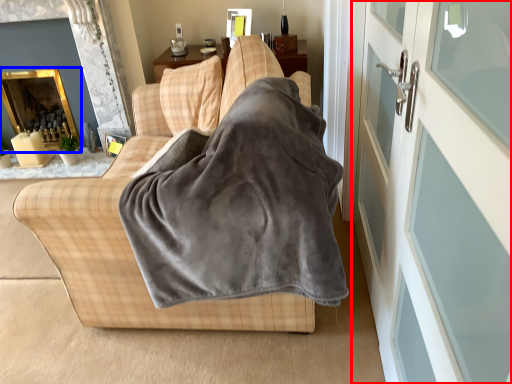
Question: Which object appears farthest to the camera in this image, screen door (highlighted by a red box) or fireplace (highlighted by a blue box)?

Choices:
 (A) screen door
 (B) fireplace

Answer: (B)